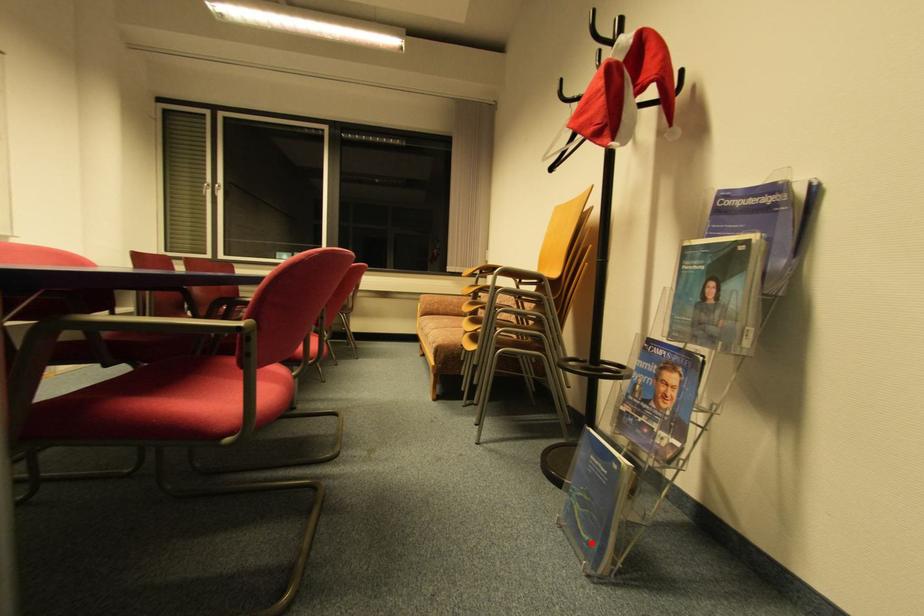
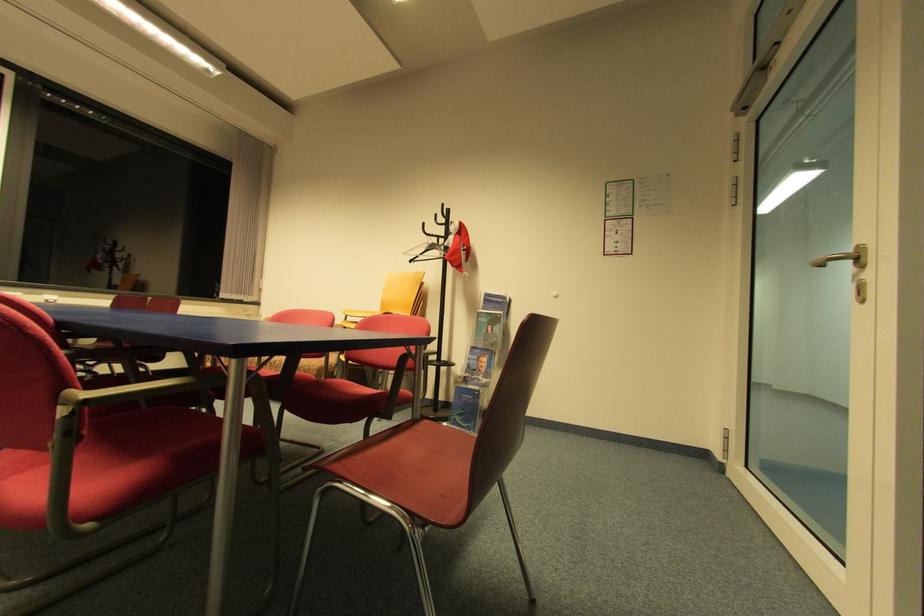
Question: I am providing you with two images of the same scene from different viewpoints. A red point is shown in image1. For the corresponding object point in image2, is it positioned nearer or farther from the camera?

Choices:
 (A) Nearer
 (B) Farther

Answer: (B)